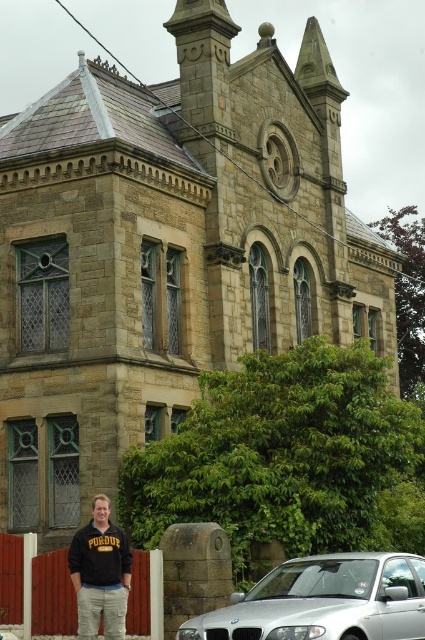
You are standing at the entrance of the historic stone building and want to park your car at the silver metallic car at lower center. What are the coordinates of the parking spot?

The coordinates of the parking spot for the silver metallic car at lower center are at point [325,602].

You are standing in front of a historic stone building. A point marked at coordinates (333, 589) is 38.36 meters away from you. If you want to reach that point, which direction should you move relative to the building?

The point at (333, 589) is 38.36 meters away from the viewer. Since the point is located in the lower right corner of the image, you should move towards the right side of the building to reach it.